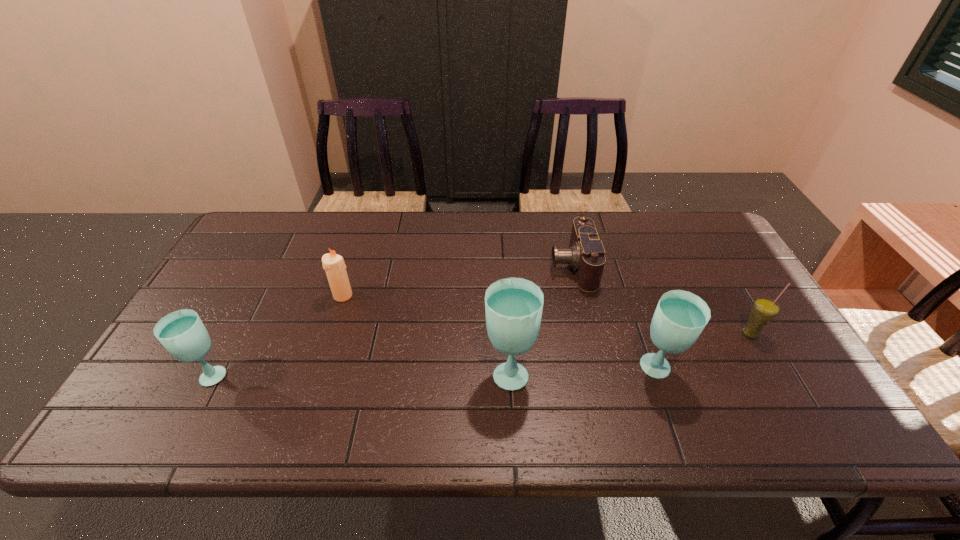
The image size is (960, 540). Find the location of `object located in the right edge section of the desktop`. object located in the right edge section of the desktop is located at coordinates [x=764, y=310].

I want to click on object that is at the near left corner, so click(182, 333).

The height and width of the screenshot is (540, 960). In the image, there is a desktop. Identify the location of vacant space at the far edge. (305, 249).

In the image, there is a desktop. At what (x,y) coordinates should I click in order to perform the action: click on free space at the near edge. Please return your answer as a coordinate pair (x, y). Looking at the image, I should click on (421, 370).

The image size is (960, 540). In the image, there is a desktop. Find the location of `vacant region at the left edge`. vacant region at the left edge is located at coordinates (223, 322).

The width and height of the screenshot is (960, 540). Find the location of `vacant space at the right edge of the desktop`. vacant space at the right edge of the desktop is located at coordinates (731, 340).

The height and width of the screenshot is (540, 960). Find the location of `free location at the far right corner`. free location at the far right corner is located at coordinates (676, 230).

This screenshot has width=960, height=540. I want to click on vacant space at the near right corner of the desktop, so click(x=806, y=395).

Where is `unoccupied position between the rightmost object and the fifth object from right to left`? unoccupied position between the rightmost object and the fifth object from right to left is located at coordinates (546, 315).

Find the location of a particular element. The image size is (960, 540). blank region between the third object from left to right and the second tallest glass is located at coordinates (583, 371).